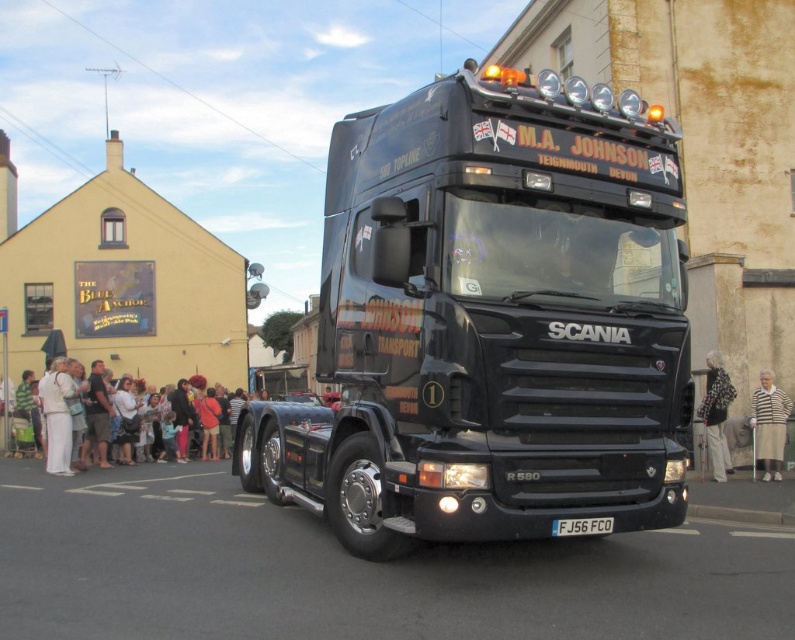
You are standing at the entrance of THE BLUE ANCHOR pub and want to take a photo of the black matte truck at center. Where should you position yourself to ensure the truck is centered in your camera frame?

To center the black matte truck at center in your camera frame, position yourself directly in front of the truck at point (491, 321).